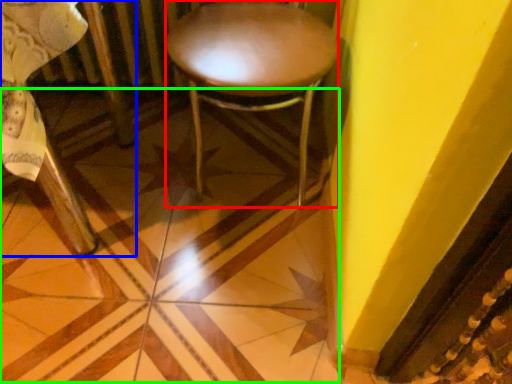
Question: Which is farther away from stool (highlighted by a red box)? chair (highlighted by a blue box) or tile (highlighted by a green box)?

Choices:
 (A) chair
 (B) tile

Answer: (A)